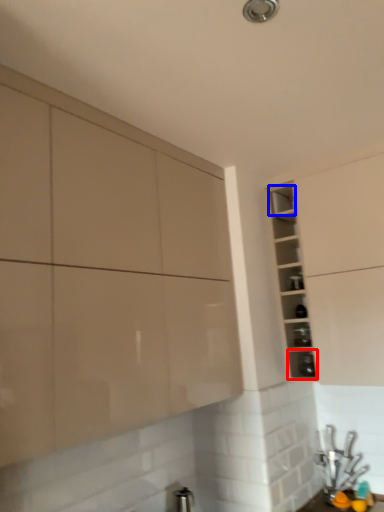
Question: Which point is further to the camera, shelf (highlighted by a red box) or shelf (highlighted by a blue box)?

Choices:
 (A) shelf
 (B) shelf

Answer: (B)